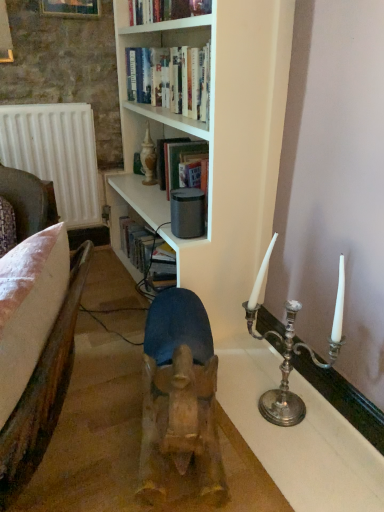
At what (x,y) coordinates should I click in order to perform the action: click on free spot below silver metallic candle holder at right (from a real-world perspective). Please return your answer as a coordinate pair (x, y). The height and width of the screenshot is (512, 384). Looking at the image, I should click on (276, 412).